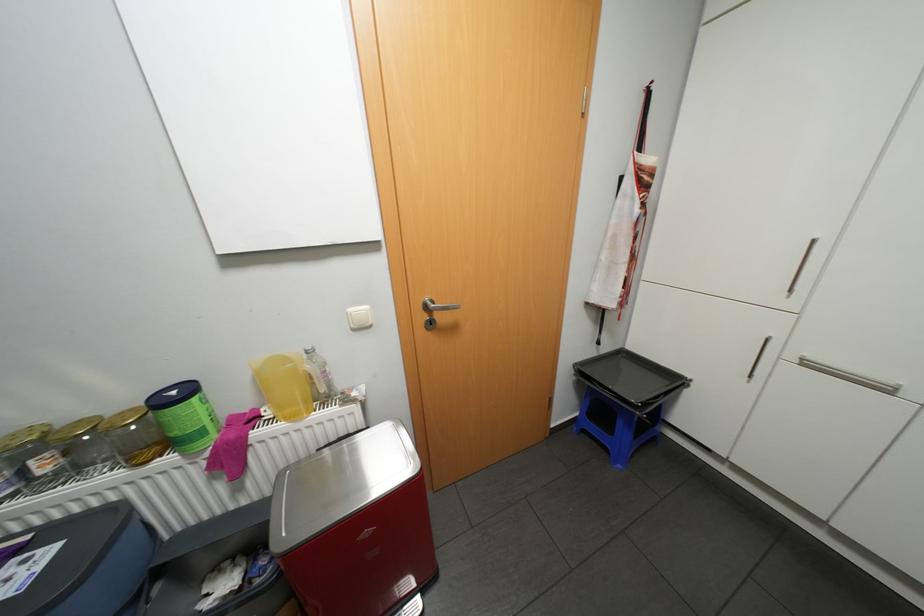
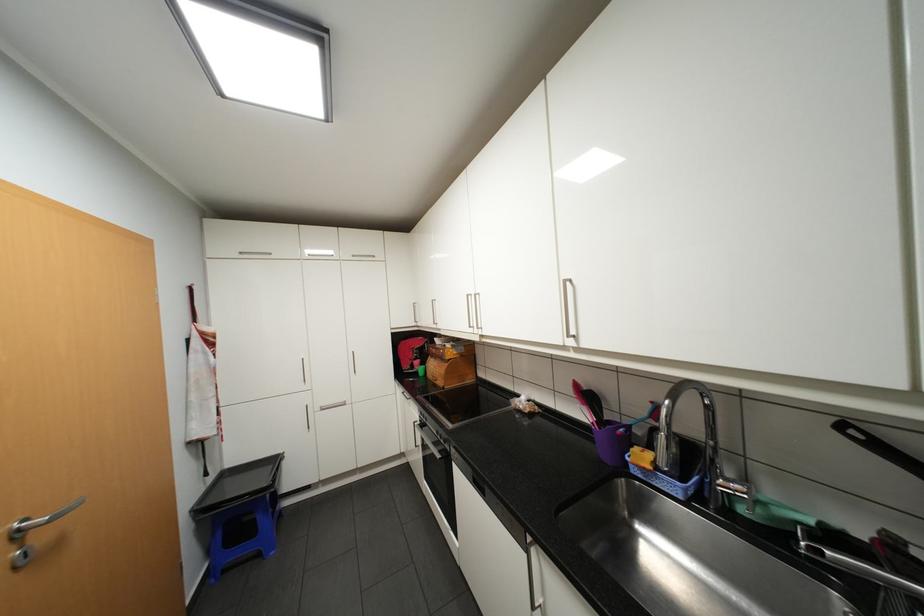
Find the pixel in the second image that matches point 614,347 in the first image.

(220, 476)